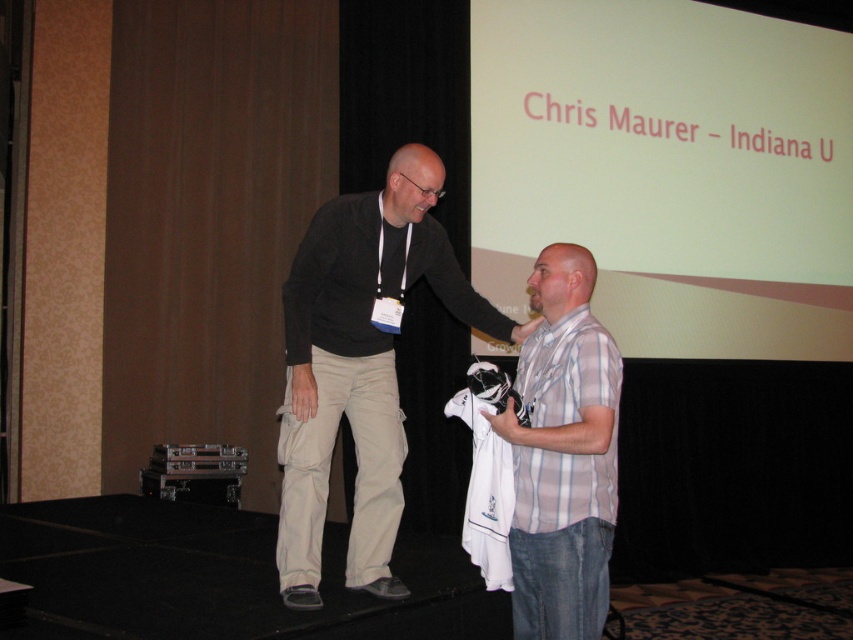
Does point (299, 253) come in front of point (584, 371)?

No, it is behind (584, 371).

How much distance is there between khaki cotton pants at center and white striped shirt at center?

17.81 inches

Image resolution: width=853 pixels, height=640 pixels. What do you see at coordinates (360, 365) in the screenshot?
I see `khaki cotton pants at center` at bounding box center [360, 365].

Find the location of `khaki cotton pants at center`. khaki cotton pants at center is located at coordinates (360, 365).